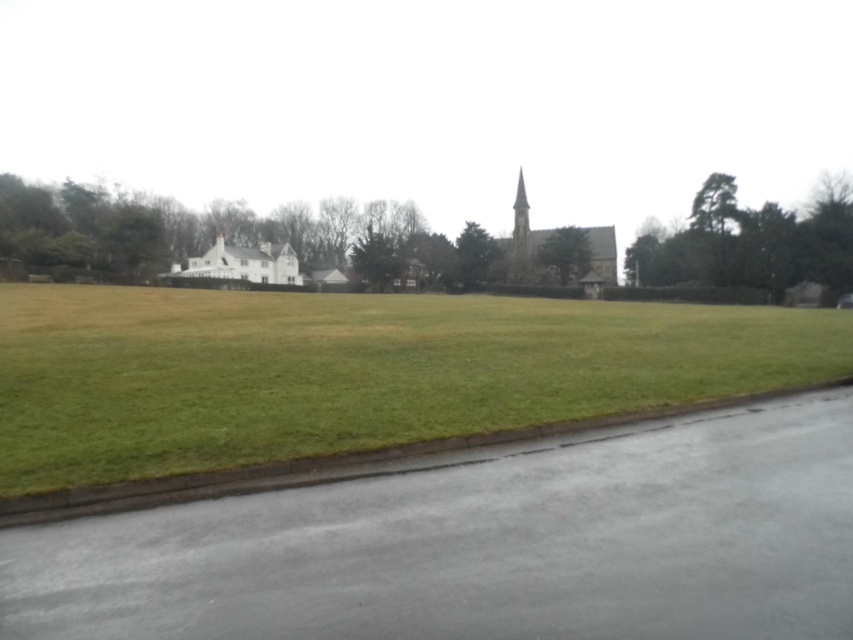
Question: Which of the following is the closest to the observer?

Choices:
 (A) green grass at center
 (B) smooth stone church at center
 (C) white matte house at center
 (D) smooth stone spire at center

Answer: (A)

Question: Does green grass at center appear on the right side of smooth stone spire at center?

Choices:
 (A) yes
 (B) no

Answer: (B)

Question: Which point is farther from the camera taking this photo?

Choices:
 (A) (268, 243)
 (B) (509, 280)
 (C) (688, 332)
 (D) (518, 208)

Answer: (D)

Question: Is white matte house at center further to camera compared to smooth stone spire at center?

Choices:
 (A) no
 (B) yes

Answer: (A)

Question: Can you confirm if white matte house at center is positioned to the right of smooth stone church at center?

Choices:
 (A) no
 (B) yes

Answer: (A)

Question: Based on their relative distances, which object is farther from the green grass at center?

Choices:
 (A) smooth stone church at center
 (B) smooth stone spire at center
 (C) white matte house at center

Answer: (B)